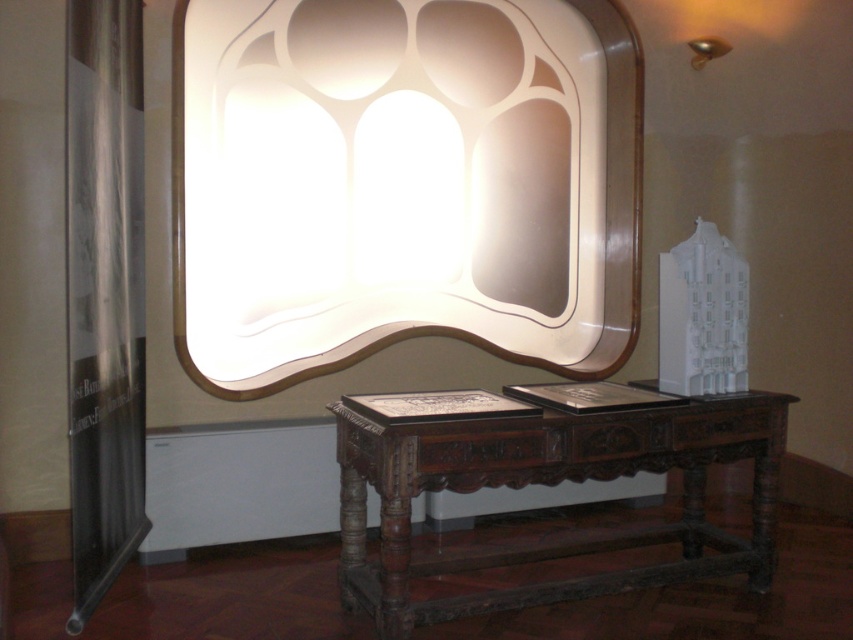
You are a museum guide who needs to move a 4.5 feet wide sculpture from the entrance to the display area. The path between the white glossy mirror at upper center and the dark brown wood table at center is 4.60 feet. Can the sculpture fit through the space between them?

The path between the white glossy mirror at upper center and the dark brown wood table at center is 4.60 feet, so the 4.5 feet wide sculpture can fit through the space since it is slightly narrower than the available width.

You are an interior designer planning to install a new light fixture between the white glossy mirror at upper center and the metallic gold lamp at upper right. The fixture requires a minimum of 5 feet of space between it and any existing fixtures. Based on the current spacing, is this installation feasible?

The distance between the white glossy mirror at upper center and the metallic gold lamp at upper right is 4.58 feet, which is less than the required 5 feet. Therefore, installing the new light fixture between them would not meet the spacing requirement.

You are an interior designer who wants to place a new decorative item between the dark brown wood table at center and the metallic gold lamp at upper right. Considering their sizes, which object should the new item be placed closer to?

The dark brown wood table at center is bigger than the metallic gold lamp at upper right, so the new decorative item should be placed closer to the metallic gold lamp at upper right to balance the size difference.